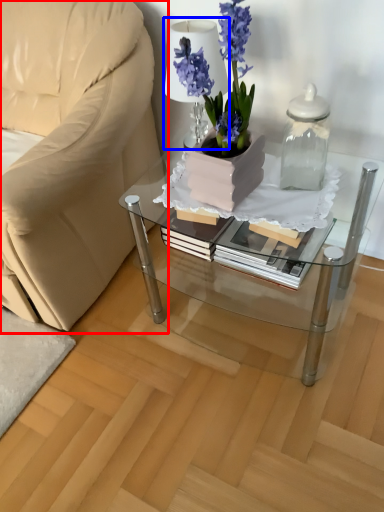
Question: Which of the following is the farthest to the observer, chair (highlighted by a red box) or table lamp (highlighted by a blue box)?

Choices:
 (A) chair
 (B) table lamp

Answer: (B)